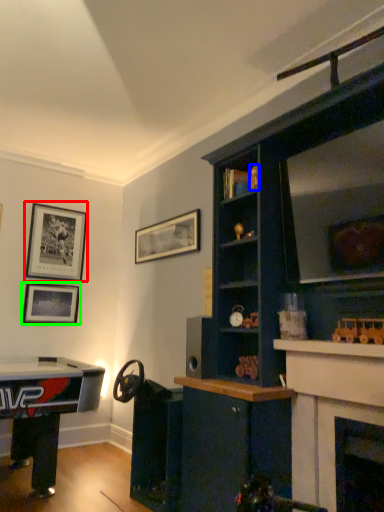
Question: Which object is the closest to the picture frame (highlighted by a red box)? Choose among these: toy (highlighted by a blue box) or picture frame (highlighted by a green box).

Choices:
 (A) toy
 (B) picture frame

Answer: (B)